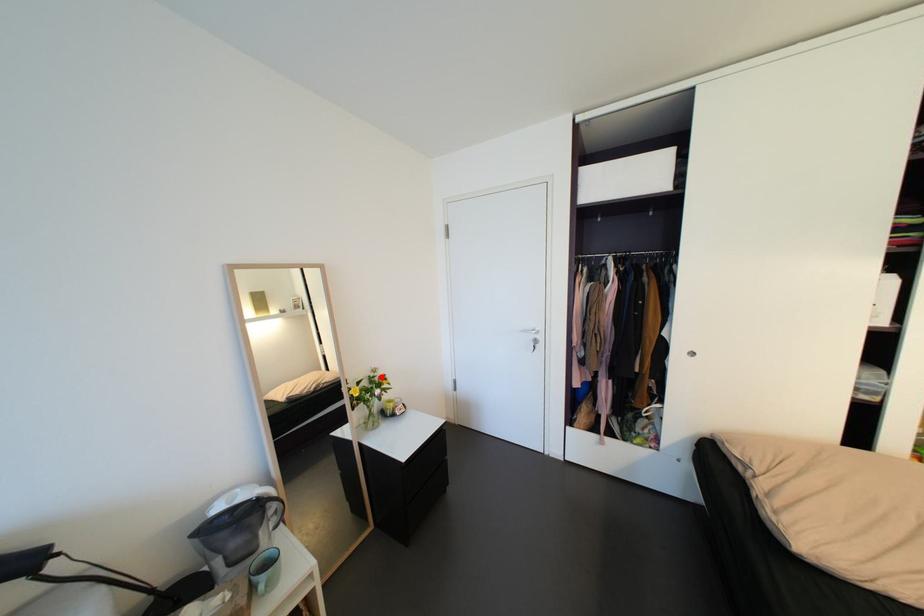
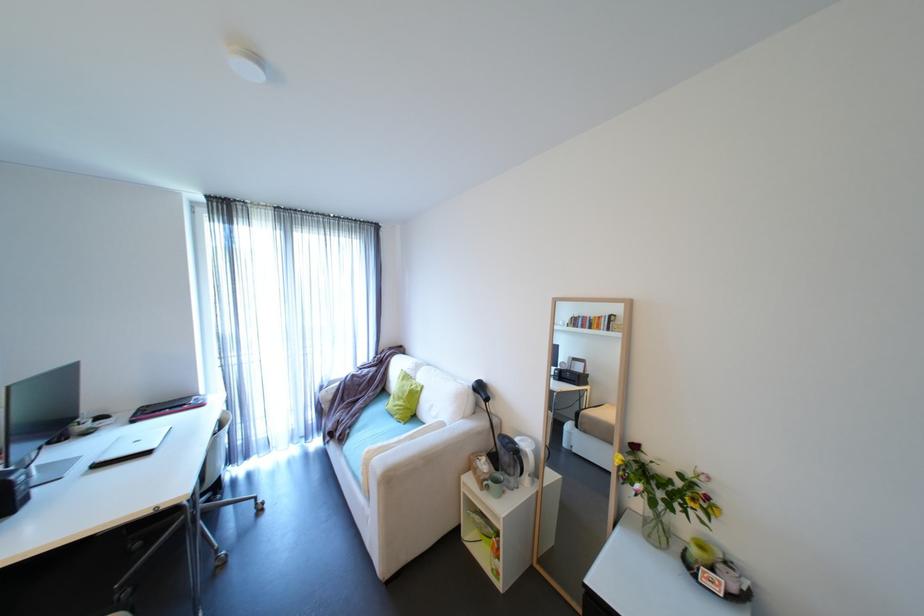
The point at the highlighted location is marked in the first image. Where is the corresponding point in the second image?

(703, 485)